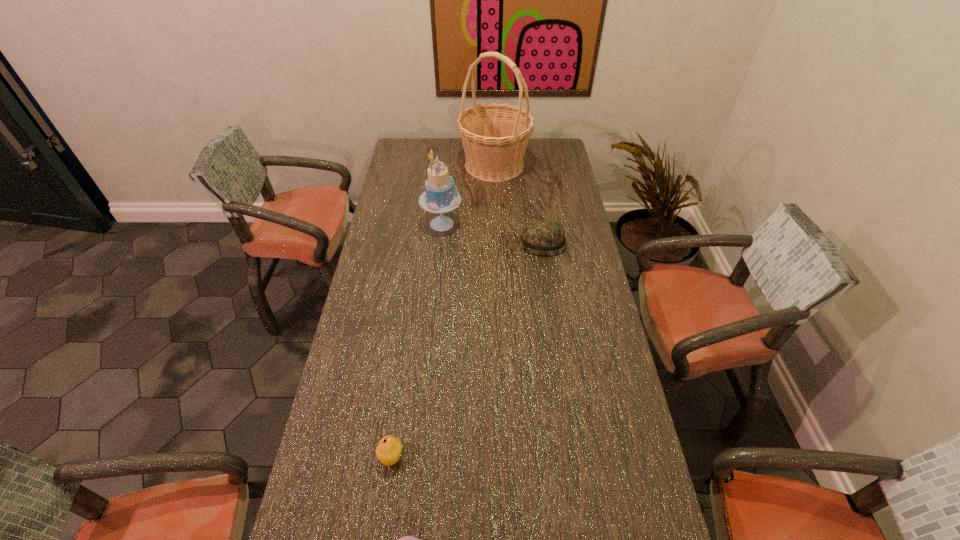
The width and height of the screenshot is (960, 540). Identify the location of object that is the third nearest to the shortest object. (440, 196).